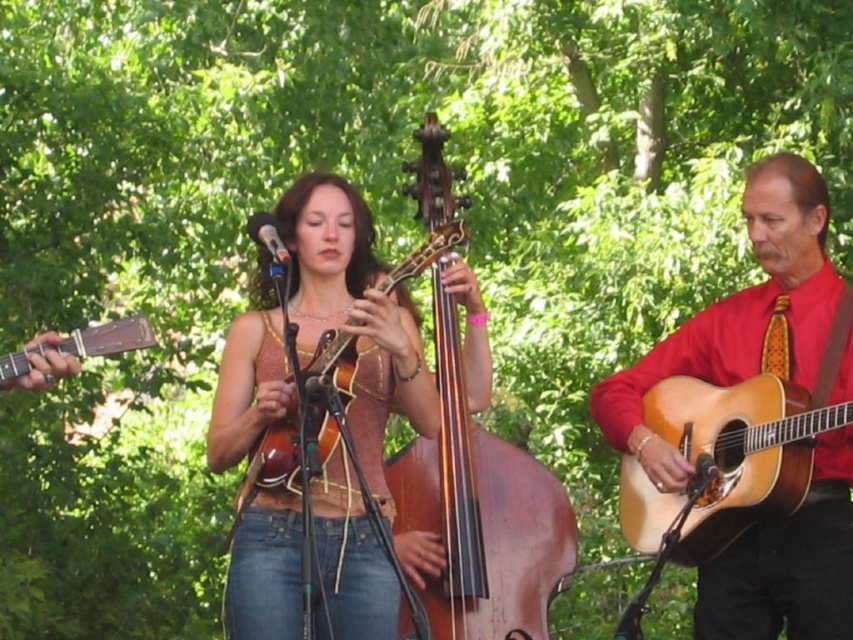
Question: Which of these objects is positioned closest to the red satin shirt at right?

Choices:
 (A) matte brown guitar at left
 (B) wooden acoustic guitar at center

Answer: (B)

Question: Among these points, which one is farthest from the camera?

Choices:
 (A) (627, 502)
 (B) (10, 369)
 (C) (845, 506)
 (D) (318, 372)

Answer: (A)

Question: In this image, where is matte brown mandolin at center located relative to metallic blue microphone at center?

Choices:
 (A) right
 (B) left

Answer: (A)

Question: Is matte brown mandolin at center above red satin shirt at right?

Choices:
 (A) no
 (B) yes

Answer: (A)

Question: Considering the relative positions of matte brown mandolin at center and natural wood acoustic guitar at right in the image provided, where is matte brown mandolin at center located with respect to natural wood acoustic guitar at right?

Choices:
 (A) right
 (B) left

Answer: (B)

Question: Which point appears farthest from the camera in this image?

Choices:
 (A) (247, 230)
 (B) (635, 538)
 (C) (125, 337)
 (D) (444, 573)

Answer: (B)